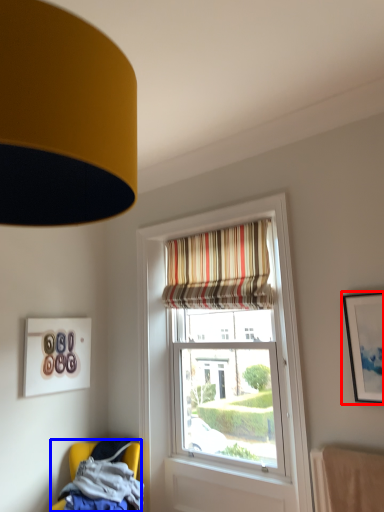
Question: Which object is further to the camera taking this photo, picture frame (highlighted by a red box) or chair (highlighted by a blue box)?

Choices:
 (A) picture frame
 (B) chair

Answer: (B)